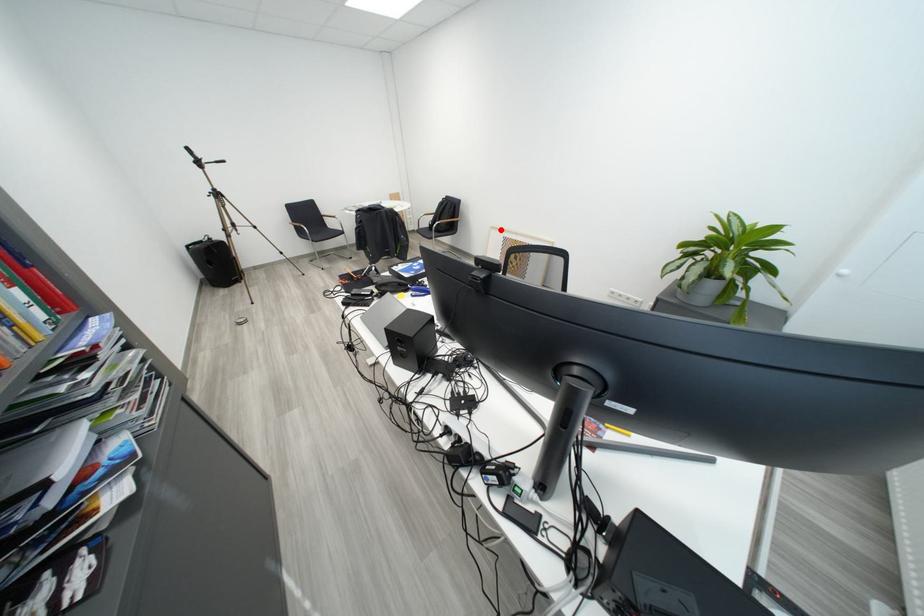
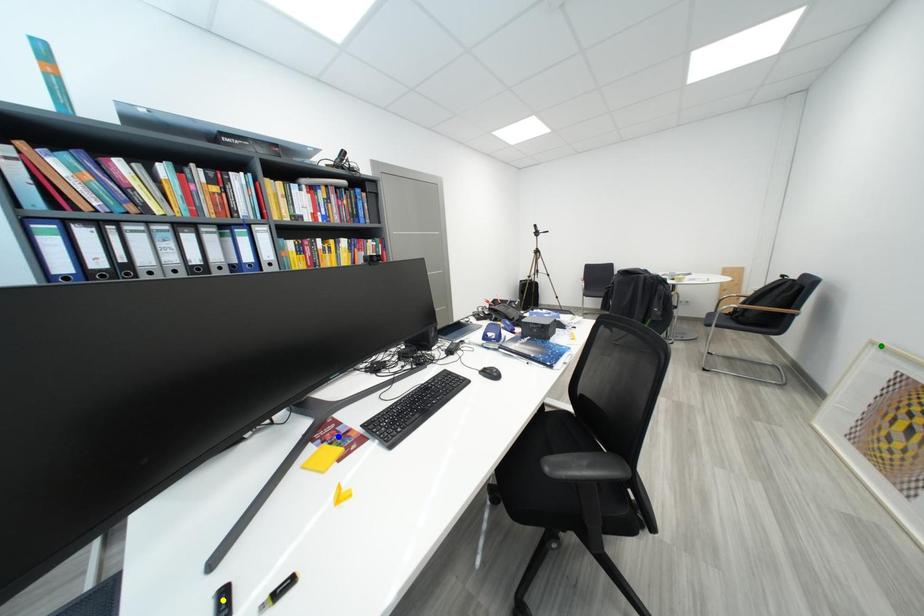
Question: I am providing you with two images of the same scene from different viewpoints. A red point is marked on the first image. You are given multiple points on the second image. Which point in image 2 is actually the same real-world point as the red point in image 1?

Choices:
 (A) green point
 (B) yellow point
 (C) blue point

Answer: (A)